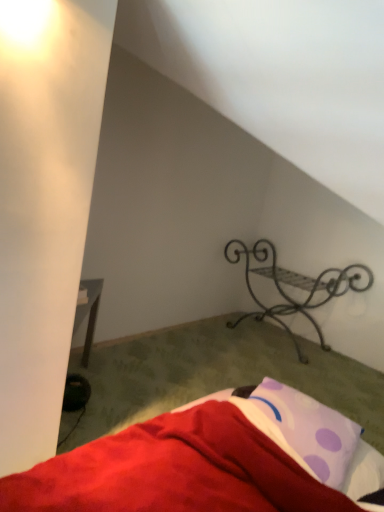
Where is `red soft fabric bed at lower right`? red soft fabric bed at lower right is located at coordinates (205, 460).

Image resolution: width=384 pixels, height=512 pixels. Find the location of `purple dotted pillow at lower right`. purple dotted pillow at lower right is located at coordinates pyautogui.click(x=309, y=430).

Find the location of a particular element. The width and height of the screenshot is (384, 512). red soft fabric bed at lower right is located at coordinates (205, 460).

Is black wrought iron shelf at upper right far from purple dotted pillow at lower right?

That's right, there is a large distance between black wrought iron shelf at upper right and purple dotted pillow at lower right.

Considering their positions, is black wrought iron shelf at upper right located in front of or behind purple dotted pillow at lower right?

In the image, black wrought iron shelf at upper right appears behind purple dotted pillow at lower right.

Consider the image. Is black wrought iron shelf at upper right facing towards purple dotted pillow at lower right?

Yes, black wrought iron shelf at upper right is aimed at purple dotted pillow at lower right.

From their relative heights in the image, would you say black wrought iron shelf at upper right is taller or shorter than purple dotted pillow at lower right?

Considering their sizes, black wrought iron shelf at upper right has more height than purple dotted pillow at lower right.

Considering the sizes of objects black wrought iron shelf at upper right and red soft fabric bed at lower right in the image provided, who is thinner, black wrought iron shelf at upper right or red soft fabric bed at lower right?

black wrought iron shelf at upper right.

The height and width of the screenshot is (512, 384). In the image, there is a black wrought iron shelf at upper right. Identify the location of bed below it (from a real-world perspective). (205, 460).

What's the angular difference between black wrought iron shelf at upper right and red soft fabric bed at lower right's facing directions?

The facing directions of black wrought iron shelf at upper right and red soft fabric bed at lower right are 0.746 degrees apart.

Can you confirm if black wrought iron shelf at upper right is shorter than red soft fabric bed at lower right?

No.

Would you consider red soft fabric bed at lower right to be distant from purple dotted pillow at lower right?

red soft fabric bed at lower right is actually quite close to purple dotted pillow at lower right.

Based on the photo, is red soft fabric bed at lower right oriented towards purple dotted pillow at lower right?

No, red soft fabric bed at lower right does not turn towards purple dotted pillow at lower right.

From a real-world perspective, is red soft fabric bed at lower right above or below purple dotted pillow at lower right?

From a real-world perspective, red soft fabric bed at lower right is physically below purple dotted pillow at lower right.

Does red soft fabric bed at lower right contain purple dotted pillow at lower right?

No, red soft fabric bed at lower right does not contain purple dotted pillow at lower right.

Looking at this image, from a real-world perspective, is purple dotted pillow at lower right on top of red soft fabric bed at lower right?

Yes.

Is purple dotted pillow at lower right positioned behind red soft fabric bed at lower right?

Yes, it is.

Is point (341, 473) positioned after point (283, 498)?

That is True.

From the picture: Can you tell me how much purple dotted pillow at lower right and red soft fabric bed at lower right differ in facing direction?

88.1 degrees.

Locate an element on the screen. The height and width of the screenshot is (512, 384). furniture above the red soft fabric bed at lower right (from the image's perspective) is located at coordinates (295, 286).

Is red soft fabric bed at lower right not inside black wrought iron shelf at upper right?

Yes, red soft fabric bed at lower right is outside of black wrought iron shelf at upper right.

Considering the sizes of objects red soft fabric bed at lower right and black wrought iron shelf at upper right in the image provided, who is shorter, red soft fabric bed at lower right or black wrought iron shelf at upper right?

Standing shorter between the two is red soft fabric bed at lower right.

How many degrees apart are the facing directions of red soft fabric bed at lower right and black wrought iron shelf at upper right?

red soft fabric bed at lower right and black wrought iron shelf at upper right are facing 0.746 degrees away from each other.

Considering the sizes of objects purple dotted pillow at lower right and black wrought iron shelf at upper right in the image provided, who is wider, purple dotted pillow at lower right or black wrought iron shelf at upper right?

With larger width is black wrought iron shelf at upper right.

From a real-world perspective, is purple dotted pillow at lower right above or below black wrought iron shelf at upper right?

purple dotted pillow at lower right is situated higher than black wrought iron shelf at upper right in the real world.

You are a GUI agent. You are given a task and a screenshot of the screen. Output one action in this format:
    pyautogui.click(x=<x>, y=<y>)
    Task: Click on the furniture that appears above the purple dotted pillow at lower right (from the image's perspective)
    The height and width of the screenshot is (512, 384).
    Given the screenshot: What is the action you would take?
    pyautogui.click(x=295, y=286)

From the picture: Is purple dotted pillow at lower right taller than black wrought iron shelf at upper right?

In fact, purple dotted pillow at lower right may be shorter than black wrought iron shelf at upper right.

Find the location of a particular element. Image resolution: width=384 pixels, height=512 pixels. furniture behind the purple dotted pillow at lower right is located at coordinates (295, 286).

The image size is (384, 512). Find the location of `bed below the black wrought iron shelf at upper right (from a real-world perspective)`. bed below the black wrought iron shelf at upper right (from a real-world perspective) is located at coordinates (205, 460).

When comparing their distances from red soft fabric bed at lower right, does purple dotted pillow at lower right or black wrought iron shelf at upper right seem closer?

purple dotted pillow at lower right is positioned closer to the anchor red soft fabric bed at lower right.

Considering their positions, is black wrought iron shelf at upper right positioned further to red soft fabric bed at lower right than purple dotted pillow at lower right?

black wrought iron shelf at upper right is further to red soft fabric bed at lower right.

From the image, which object appears to be farther from black wrought iron shelf at upper right, red soft fabric bed at lower right or purple dotted pillow at lower right?

The object further to black wrought iron shelf at upper right is red soft fabric bed at lower right.

Looking at the image, which one is located further to black wrought iron shelf at upper right, purple dotted pillow at lower right or red soft fabric bed at lower right?

red soft fabric bed at lower right is further to black wrought iron shelf at upper right.

Which object lies further to the anchor point purple dotted pillow at lower right, red soft fabric bed at lower right or black wrought iron shelf at upper right?

The object further to purple dotted pillow at lower right is black wrought iron shelf at upper right.

From the image, which object appears to be nearer to purple dotted pillow at lower right, black wrought iron shelf at upper right or red soft fabric bed at lower right?

red soft fabric bed at lower right is positioned closer to the anchor purple dotted pillow at lower right.

Locate an element on the screen. The image size is (384, 512). pillow positioned between red soft fabric bed at lower right and black wrought iron shelf at upper right from near to far is located at coordinates (309, 430).